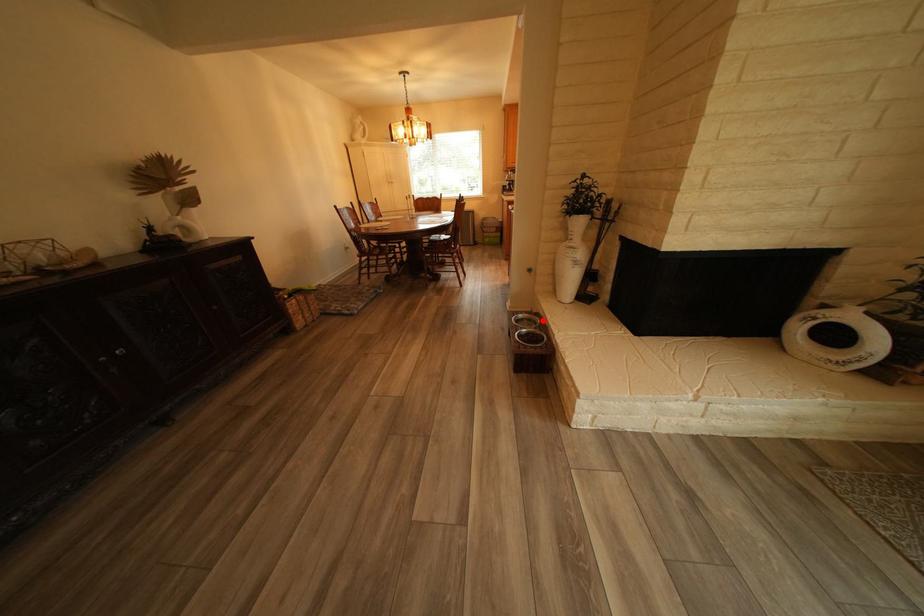
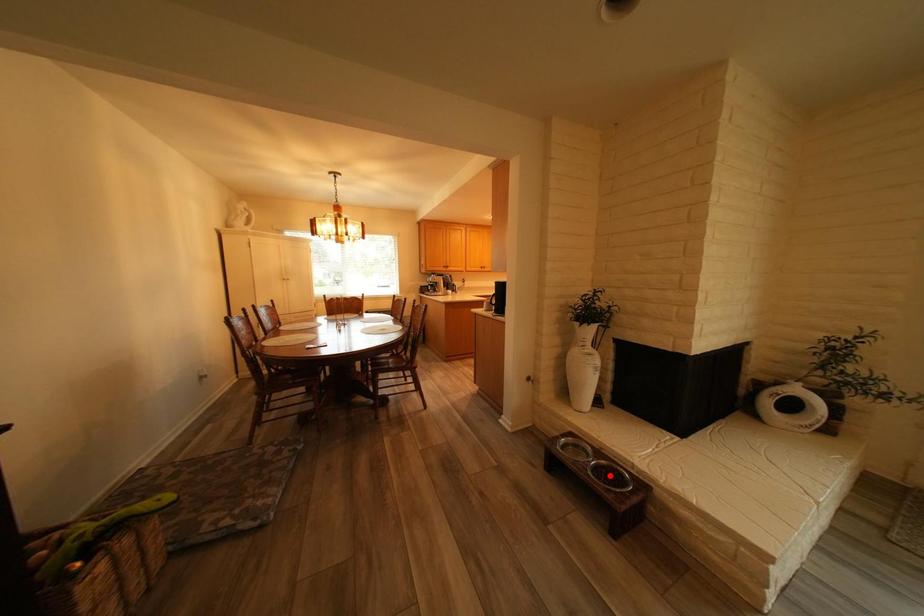
I am providing you with two images of the same scene from different viewpoints. A red point is marked on the first image and another point is marked on the second image. Is the marked point in image1 the same physical position as the marked point in image2?

No